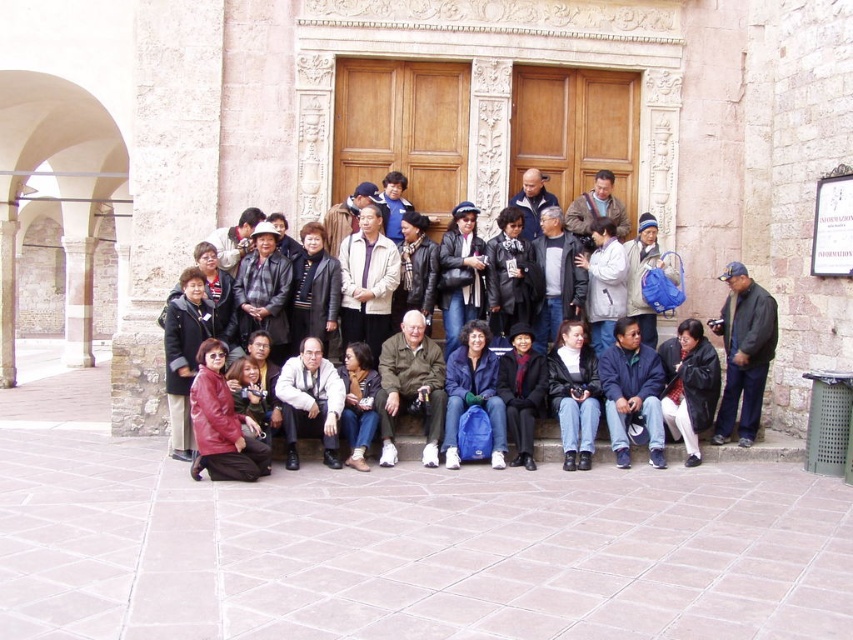
Can you confirm if black leather jacket at lower center is positioned to the right of blue fabric backpack at center?

Yes, black leather jacket at lower center is to the right of blue fabric backpack at center.

Where is `black leather jacket at lower center`? Image resolution: width=853 pixels, height=640 pixels. black leather jacket at lower center is located at coordinates (689, 385).

Which is above, khaki fabric jacket at center or black leather jacket at center?

khaki fabric jacket at center is higher up.

Can you confirm if khaki fabric jacket at center is positioned to the right of black leather jacket at center?

In fact, khaki fabric jacket at center is to the left of black leather jacket at center.

You are a GUI agent. You are given a task and a screenshot of the screen. Output one action in this format:
    pyautogui.click(x=<x>, y=<y>)
    Task: Click on the khaki fabric jacket at center
    
    Given the screenshot: What is the action you would take?
    pyautogui.click(x=410, y=387)

I want to click on khaki fabric jacket at center, so pos(410,387).

Is point (759, 333) closer to camera compared to point (575, 445)?

That is False.

Who is more forward, [762,294] or [585,337]?

Positioned in front is point [762,294].

Describe the element at coordinates (743, 353) in the screenshot. I see `blue fabric jacket at center` at that location.

Identify the location of blue fabric jacket at center. (743, 353).